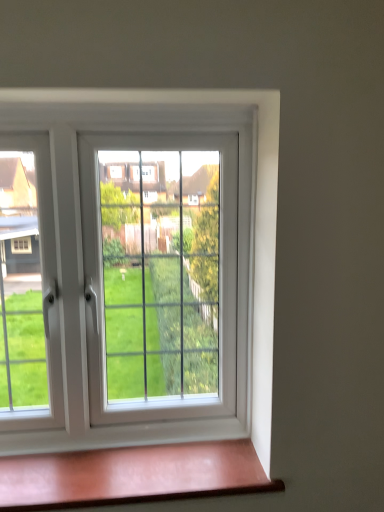
What is the approximate height of white plastic window at center?

white plastic window at center is 37.22 inches in height.

Describe the element at coordinates (83, 241) in the screenshot. I see `white plastic window at center` at that location.

The image size is (384, 512). I want to click on white plastic window at center, so click(x=83, y=241).

What do you see at coordinates (132, 475) in the screenshot?
I see `matte pink wood at lower center` at bounding box center [132, 475].

Image resolution: width=384 pixels, height=512 pixels. I want to click on matte pink wood at lower center, so click(132, 475).

The height and width of the screenshot is (512, 384). Find the location of `white plastic window at center`. white plastic window at center is located at coordinates [x=83, y=241].

In the image, is matte pink wood at lower center on the left side or the right side of white plastic window at center?

matte pink wood at lower center is positioned on white plastic window at center's right side.

Is matte pink wood at lower center positioned before white plastic window at center?

Yes, matte pink wood at lower center is closer to the viewer.

Is point (205, 481) positioned in front of point (258, 130)?

That is True.

From the image's perspective, is matte pink wood at lower center below white plastic window at center?

Correct, matte pink wood at lower center appears lower than white plastic window at center in the image.

From a real-world perspective, is matte pink wood at lower center located higher than white plastic window at center?

Incorrect, from a real-world perspective, matte pink wood at lower center is lower than white plastic window at center.

Can you confirm if matte pink wood at lower center is wider than white plastic window at center?

Yes, matte pink wood at lower center is wider than white plastic window at center.

Considering the sizes of matte pink wood at lower center and white plastic window at center in the image, is matte pink wood at lower center taller or shorter than white plastic window at center?

Clearly, matte pink wood at lower center is shorter compared to white plastic window at center.

Looking at this image, is matte pink wood at lower center bigger than white plastic window at center?

Actually, matte pink wood at lower center might be smaller than white plastic window at center.

Choose the correct answer: Is matte pink wood at lower center inside white plastic window at center or outside it?

The correct answer is: outside.

Is matte pink wood at lower center not close to white plastic window at center?

They are positioned close to each other.

Is matte pink wood at lower center turned away from white plastic window at center?

No, matte pink wood at lower center is not facing the opposite direction of white plastic window at center.

How different are the orientations of matte pink wood at lower center and white plastic window at center in degrees?

0.000723 degrees separate the facing orientations of matte pink wood at lower center and white plastic window at center.

In the image, there is a white plastic window at center. What are the coordinates of `window sill below it (from the image's perspective)` in the screenshot? It's located at 132,475.

Between white plastic window at center and matte pink wood at lower center, which one appears on the right side from the viewer's perspective?

Positioned to the right is matte pink wood at lower center.

Does white plastic window at center come behind matte pink wood at lower center?

Yes, it is behind matte pink wood at lower center.

Is point (258, 375) more distant than point (219, 495)?

Yes, point (258, 375) is behind point (219, 495).

From the image's perspective, would you say white plastic window at center is shown under matte pink wood at lower center?

No, from the image's perspective, white plastic window at center is not beneath matte pink wood at lower center.

From a real-world perspective, between white plastic window at center and matte pink wood at lower center, who is vertically lower?

matte pink wood at lower center.

Does white plastic window at center have a lesser width compared to matte pink wood at lower center?

Correct, the width of white plastic window at center is less than that of matte pink wood at lower center.

Is white plastic window at center taller or shorter than matte pink wood at lower center?

Clearly, white plastic window at center is taller compared to matte pink wood at lower center.

Is white plastic window at center bigger or smaller than matte pink wood at lower center?

Clearly, white plastic window at center is larger in size than matte pink wood at lower center.

Based on the photo, would you say white plastic window at center is inside or outside matte pink wood at lower center?

white plastic window at center is outside matte pink wood at lower center.

Is white plastic window at center not near matte pink wood at lower center?

They are positioned close to each other.

Could you tell me if white plastic window at center is turned towards matte pink wood at lower center?

Yes, white plastic window at center is oriented towards matte pink wood at lower center.

Find the location of `window that is above the matte pink wood at lower center (from the image's perspective)`. window that is above the matte pink wood at lower center (from the image's perspective) is located at coordinates (83, 241).

What are the coordinates of `window sill in front of the white plastic window at center` in the screenshot? It's located at (132, 475).

This screenshot has height=512, width=384. What are the coordinates of `window located behind the matte pink wood at lower center` in the screenshot? It's located at [83, 241].